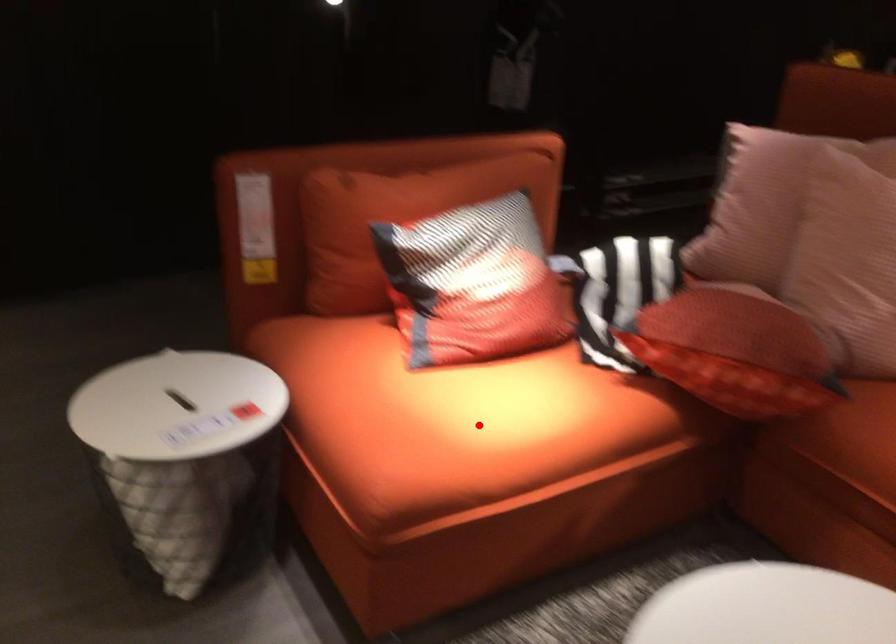
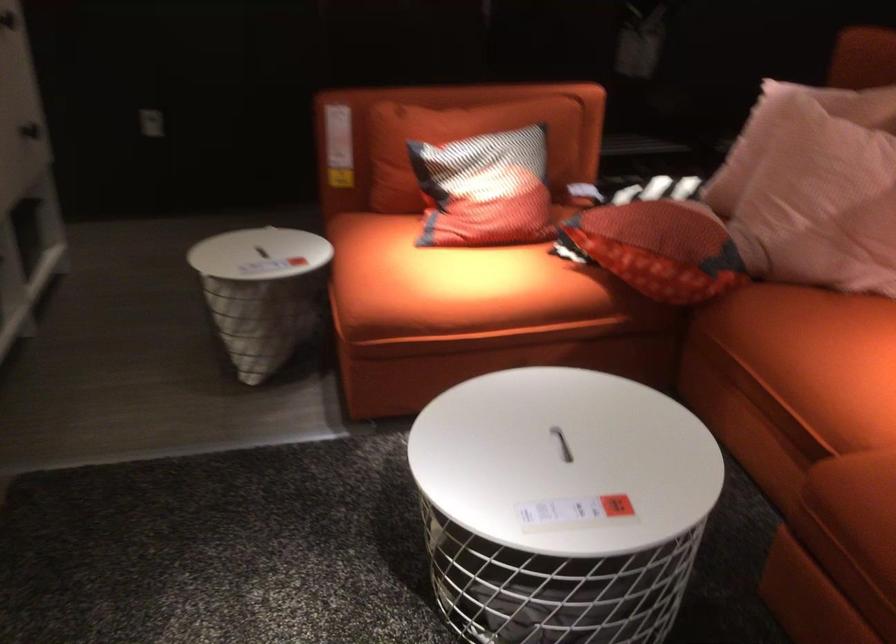
The point at the highlighted location is marked in the first image. Where is the corresponding point in the second image?

(449, 281)